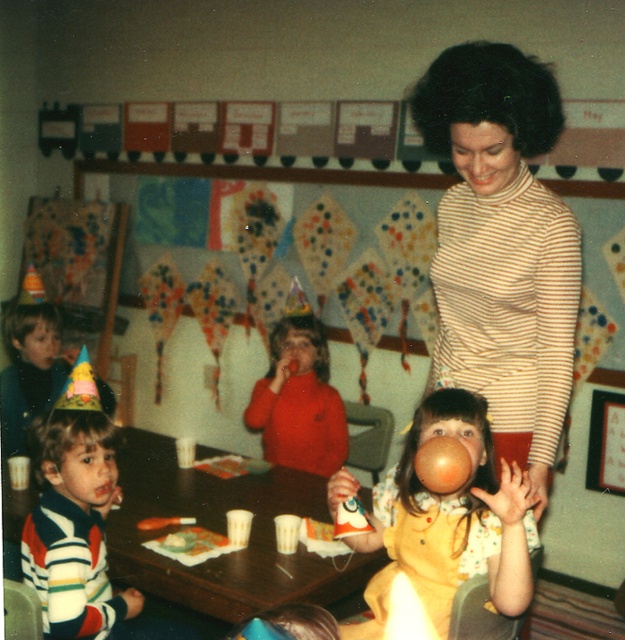
Who is more forward, (x=416, y=572) or (x=322, y=390)?

Point (x=416, y=572) is in front.

Between matte yellow dress at center and matte orange sweater at center, which one appears on the right side from the viewer's perspective?

matte yellow dress at center

Is point (422, 412) positioned after point (320, 371)?

No.

Identify the location of matte yellow dress at center. (450, 520).

Between striped turtleneck sweater at center and matte orange sweater at center, which one is positioned higher?

striped turtleneck sweater at center is above.

Does striped turtleneck sweater at center have a greater width compared to matte orange sweater at center?

Yes, striped turtleneck sweater at center is wider than matte orange sweater at center.

At what (x,y) coordinates should I click in order to perform the action: click on striped turtleneck sweater at center. Please return your answer as a coordinate pair (x, y). The image size is (625, 640). Looking at the image, I should click on (502, 248).

Where is `striped turtleneck sweater at center`? The height and width of the screenshot is (640, 625). striped turtleneck sweater at center is located at coordinates [502, 248].

Which is more to the right, wooden table at lower center or matte yellow dress at center?

matte yellow dress at center

Between wooden table at lower center and matte yellow dress at center, which one appears on the left side from the viewer's perspective?

wooden table at lower center

You are a GUI agent. You are given a task and a screenshot of the screen. Output one action in this format:
    pyautogui.click(x=<x>, y=<y>)
    Task: Click on the wooden table at lower center
    The height and width of the screenshot is (640, 625).
    Given the screenshot: What is the action you would take?
    pyautogui.click(x=222, y=532)

Find the location of a particular element. This screenshot has height=640, width=625. wooden table at lower center is located at coordinates (222, 532).